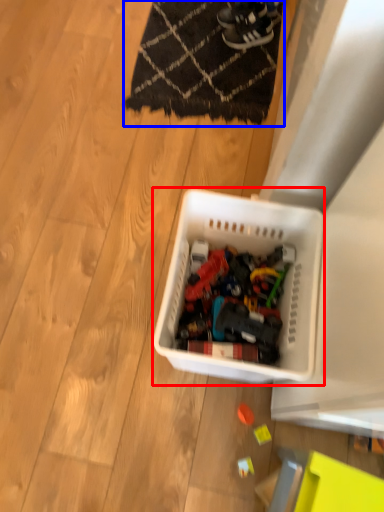
Question: Which point is closer to the camera, storage box (highlighted by a red box) or mat (highlighted by a blue box)?

Choices:
 (A) storage box
 (B) mat

Answer: (A)